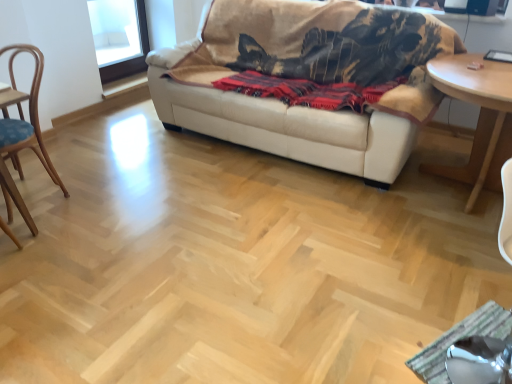
Where is `free space that is in between wooden chair at left and beige leather couch at upper center`? free space that is in between wooden chair at left and beige leather couch at upper center is located at coordinates (185, 183).